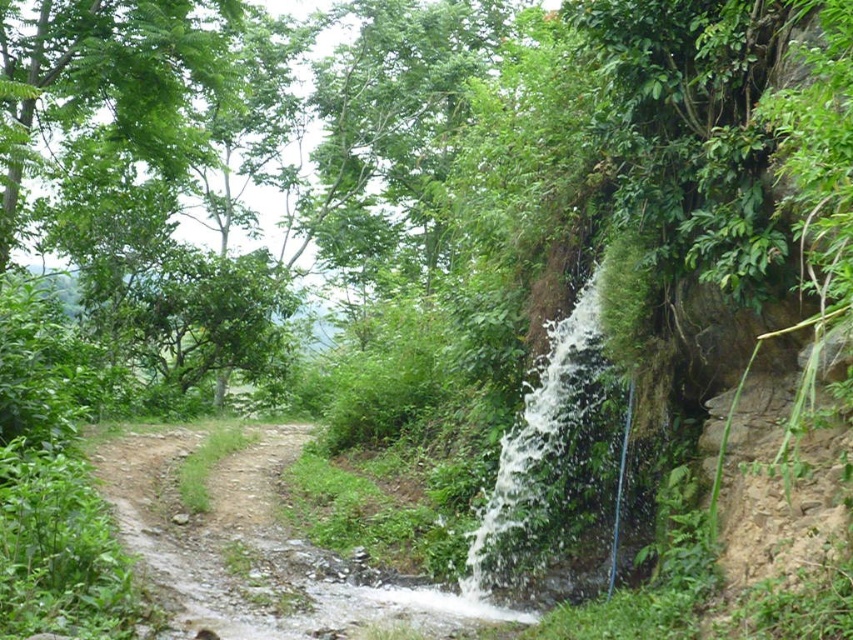
Who is positioned more to the left, green leafy tree at upper left or white frothy water at right?

Positioned to the left is green leafy tree at upper left.

Where is `green leafy tree at upper left`? green leafy tree at upper left is located at coordinates (228, 140).

Locate an element on the screen. This screenshot has width=853, height=640. green leafy tree at upper left is located at coordinates (x=228, y=140).